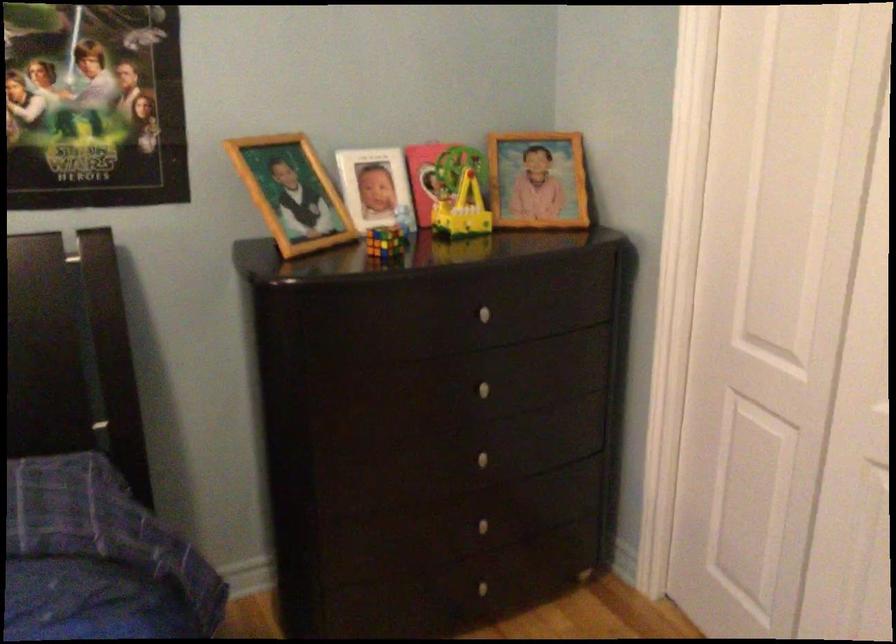
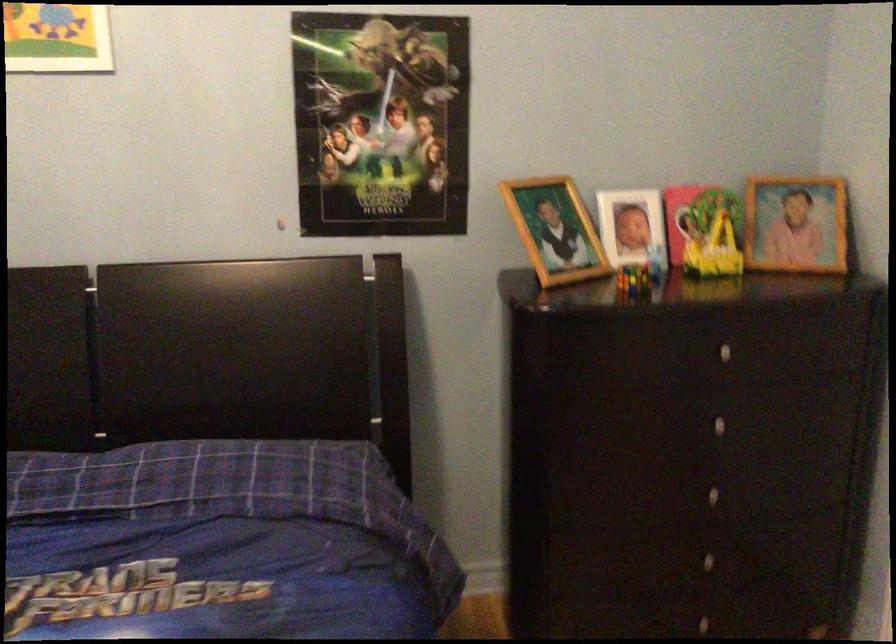
Locate, in the second image, the point that corresponds to the point at 389,243 in the first image.

(634, 279)